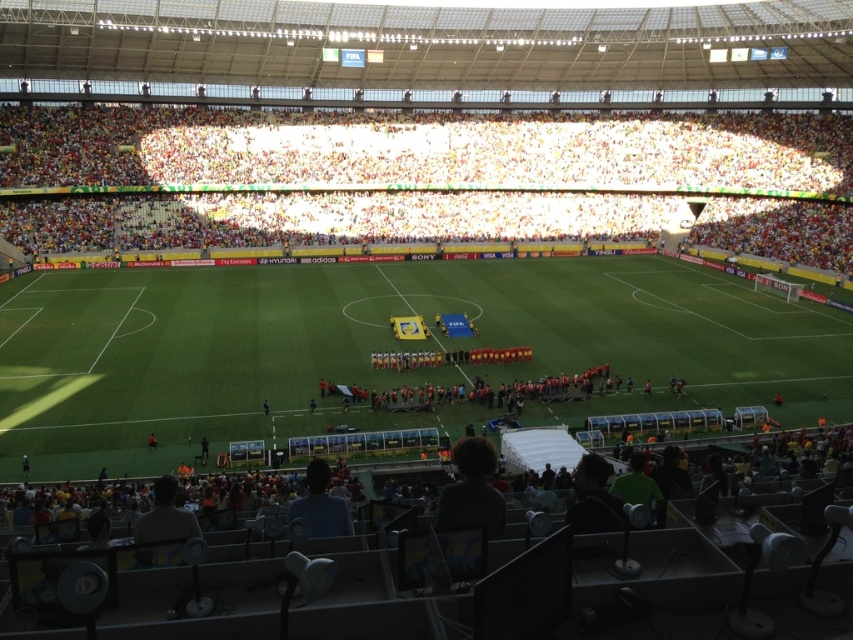
Question: Is dark gray shirt at lower left positioned in front of dark blue shirt at lower center?

Choices:
 (A) no
 (B) yes

Answer: (B)

Question: Which object is farther from the camera taking this photo?

Choices:
 (A) white fabric crowd at upper center
 (B) dark green jersey at lower right
 (C) dark blue shirt at lower center
 (D) green grass football field at center

Answer: (A)

Question: Which of these objects is positioned farthest from the green grass football field at center?

Choices:
 (A) dark blue shirt at lower center
 (B) white fabric crowd at upper center

Answer: (A)

Question: Is the position of green grass football field at center less distant than that of dark gray shirt at lower left?

Choices:
 (A) no
 (B) yes

Answer: (A)

Question: Which point appears farthest from the camera in this image?

Choices:
 (A) (160, 509)
 (B) (144, 230)
 (C) (583, 500)

Answer: (B)

Question: Can you confirm if white fabric crowd at upper center is thinner than dark blue shirt at lower center?

Choices:
 (A) no
 (B) yes

Answer: (A)